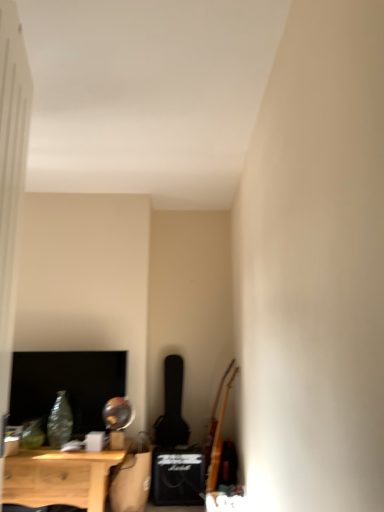
Describe the element at coordinates (60, 477) in the screenshot. I see `light wood nightstand at lower left` at that location.

The height and width of the screenshot is (512, 384). What are the coordinates of `light wood nightstand at lower left` in the screenshot? It's located at (60, 477).

What do you see at coordinates (218, 434) in the screenshot? I see `wooden acoustic guitar at right` at bounding box center [218, 434].

Where is `wooden acoustic guitar at right`? Image resolution: width=384 pixels, height=512 pixels. wooden acoustic guitar at right is located at coordinates (218, 434).

Identify the location of light wood nightstand at lower left. (60, 477).

Can you confirm if wooden acoustic guitar at right is positioned to the left of light wood nightstand at lower left?

No, wooden acoustic guitar at right is not to the left of light wood nightstand at lower left.

Between wooden acoustic guitar at right and light wood nightstand at lower left, which one is positioned behind?

Positioned behind is wooden acoustic guitar at right.

Is point (213, 436) in front of point (25, 461)?

No.

From the image's perspective, is wooden acoustic guitar at right above light wood nightstand at lower left?

Yes, from the image's perspective, wooden acoustic guitar at right is over light wood nightstand at lower left.

From a real-world perspective, is wooden acoustic guitar at right positioned under light wood nightstand at lower left based on gravity?

No.

Which of these two, wooden acoustic guitar at right or light wood nightstand at lower left, is thinner?

With smaller width is wooden acoustic guitar at right.

Considering the relative sizes of wooden acoustic guitar at right and light wood nightstand at lower left in the image provided, is wooden acoustic guitar at right shorter than light wood nightstand at lower left?

No, wooden acoustic guitar at right is not shorter than light wood nightstand at lower left.

Which of these two, wooden acoustic guitar at right or light wood nightstand at lower left, is bigger?

light wood nightstand at lower left is bigger.

Is wooden acoustic guitar at right inside the boundaries of light wood nightstand at lower left, or outside?

wooden acoustic guitar at right is not inside light wood nightstand at lower left, it's outside.

Is wooden acoustic guitar at right positioned far away from light wood nightstand at lower left?

That's right, there is a large distance between wooden acoustic guitar at right and light wood nightstand at lower left.

Could you tell me if wooden acoustic guitar at right is facing light wood nightstand at lower left?

Yes, wooden acoustic guitar at right is facing light wood nightstand at lower left.

Based on the photo, what's the angular difference between wooden acoustic guitar at right and light wood nightstand at lower left's facing directions?

They differ by 95.1 degrees in their facing directions.

You are a GUI agent. You are given a task and a screenshot of the screen. Output one action in this format:
    pyautogui.click(x=<x>, y=<y>)
    Task: Click on the instrument that is on the right side of light wood nightstand at lower left
    The image size is (384, 512).
    Given the screenshot: What is the action you would take?
    pyautogui.click(x=218, y=434)

Which object is positioned more to the right, light wood nightstand at lower left or wooden acoustic guitar at right?

wooden acoustic guitar at right.

Which object is closer to the camera taking this photo, light wood nightstand at lower left or wooden acoustic guitar at right?

light wood nightstand at lower left.

Does point (74, 468) lie in front of point (219, 457)?

Yes, point (74, 468) is in front of point (219, 457).

From the image's perspective, is light wood nightstand at lower left under wooden acoustic guitar at right?

Yes, from the image's perspective, light wood nightstand at lower left is beneath wooden acoustic guitar at right.

From a real-world perspective, is light wood nightstand at lower left physically above wooden acoustic guitar at right?

No.

Which object is thinner, light wood nightstand at lower left or wooden acoustic guitar at right?

wooden acoustic guitar at right.

Between light wood nightstand at lower left and wooden acoustic guitar at right, which one has less height?

light wood nightstand at lower left.

Considering the relative sizes of light wood nightstand at lower left and wooden acoustic guitar at right in the image provided, is light wood nightstand at lower left smaller than wooden acoustic guitar at right?

Actually, light wood nightstand at lower left might be larger than wooden acoustic guitar at right.

Do you think light wood nightstand at lower left is within wooden acoustic guitar at right, or outside of it?

light wood nightstand at lower left is not enclosed by wooden acoustic guitar at right.

Is light wood nightstand at lower left next to wooden acoustic guitar at right and touching it?

No.

Could you tell me if light wood nightstand at lower left is turned towards wooden acoustic guitar at right?

No, light wood nightstand at lower left does not turn towards wooden acoustic guitar at right.

Can you tell me how much light wood nightstand at lower left and wooden acoustic guitar at right differ in facing direction?

95.1 degrees.

How distant is light wood nightstand at lower left from wooden acoustic guitar at right?

light wood nightstand at lower left is 3.43 feet from wooden acoustic guitar at right.

The height and width of the screenshot is (512, 384). What are the coordinates of `instrument that is on the right side of light wood nightstand at lower left` in the screenshot? It's located at (218, 434).

Where is `nightstand that is under the wooden acoustic guitar at right (from a real-world perspective)`? The width and height of the screenshot is (384, 512). nightstand that is under the wooden acoustic guitar at right (from a real-world perspective) is located at coordinates (60, 477).

Image resolution: width=384 pixels, height=512 pixels. I want to click on nightstand located below the wooden acoustic guitar at right (from the image's perspective), so click(60, 477).